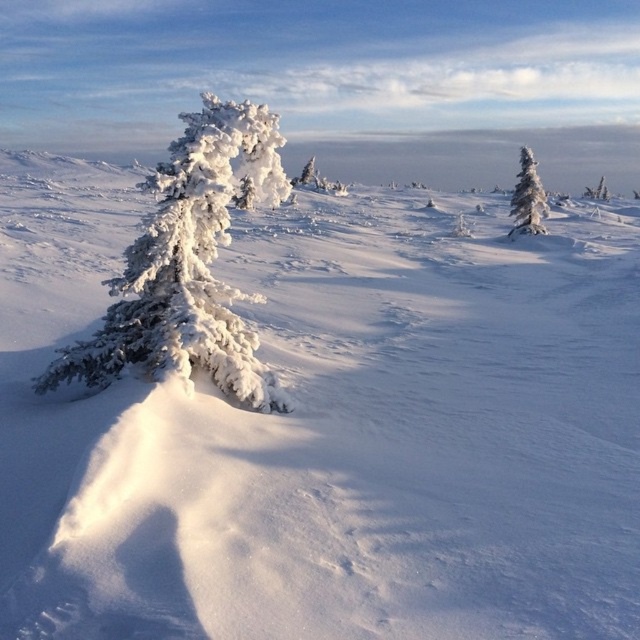
You are planning to build a snowman using the snow from around the white frosty tree at center and the white frosty tree at right. Which tree area would require you to collect more snow to build a snowman of the same size?

The white frosty tree at center is not as tall as the white frosty tree at right, so you would need to collect more snow from around the white frosty tree at center to build a snowman of the same size.

You are an observer standing at the edge of the winter landscape. You notice two trees, the white frosty tree at center and the white frosty tree at right. Which tree is closer to you?

The white frosty tree at center is closer to you because it is positioned under the white frosty tree at right, meaning it is in front of the other tree.